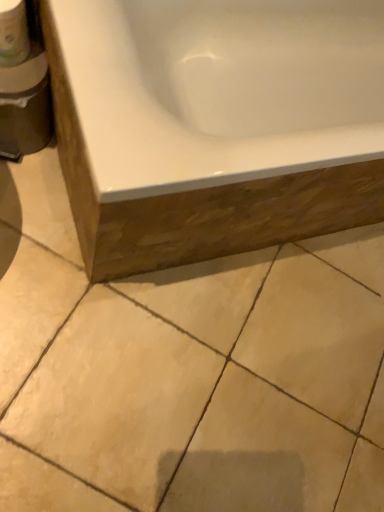
Question: Can you see beige ceramic tile at lower center touching white glossy bathtub at upper center?

Choices:
 (A) no
 (B) yes

Answer: (A)

Question: Can you confirm if beige ceramic tile at lower center is taller than white glossy bathtub at upper center?

Choices:
 (A) yes
 (B) no

Answer: (B)

Question: Is beige ceramic tile at lower center oriented towards white glossy bathtub at upper center?

Choices:
 (A) yes
 (B) no

Answer: (B)

Question: Does beige ceramic tile at lower center lie behind white glossy bathtub at upper center?

Choices:
 (A) no
 (B) yes

Answer: (B)

Question: Is beige ceramic tile at lower center completely or partially outside of white glossy bathtub at upper center?

Choices:
 (A) yes
 (B) no

Answer: (A)

Question: Considering the positions of white matte toilet paper at upper left and white glossy bathtub at upper center in the image, is white matte toilet paper at upper left taller or shorter than white glossy bathtub at upper center?

Choices:
 (A) short
 (B) tall

Answer: (A)

Question: Relative to white glossy bathtub at upper center, is white matte toilet paper at upper left in front or behind?

Choices:
 (A) behind
 (B) front

Answer: (A)

Question: Is point (9, 37) positioned closer to the camera than point (205, 145)?

Choices:
 (A) closer
 (B) farther

Answer: (B)

Question: Is white matte toilet paper at upper left wider or thinner than white glossy bathtub at upper center?

Choices:
 (A) wide
 (B) thin

Answer: (B)

Question: Considering the positions of beige ceramic tile at lower center and white matte toilet paper at upper left in the image, is beige ceramic tile at lower center bigger or smaller than white matte toilet paper at upper left?

Choices:
 (A) small
 (B) big

Answer: (B)

Question: From the image's perspective, relative to white matte toilet paper at upper left, is beige ceramic tile at lower center above or below?

Choices:
 (A) above
 (B) below

Answer: (B)

Question: Considering the positions of point 157,418 and point 11,10, is point 157,418 closer or farther from the camera than point 11,10?

Choices:
 (A) closer
 (B) farther

Answer: (B)

Question: Would you say beige ceramic tile at lower center is inside or outside white matte toilet paper at upper left?

Choices:
 (A) inside
 (B) outside

Answer: (B)

Question: In terms of width, does white matte toilet paper at upper left look wider or thinner when compared to beige ceramic tile at lower center?

Choices:
 (A) thin
 (B) wide

Answer: (A)

Question: Considering the relative positions of white matte toilet paper at upper left and beige ceramic tile at lower center in the image provided, is white matte toilet paper at upper left to the left or to the right of beige ceramic tile at lower center?

Choices:
 (A) left
 (B) right

Answer: (A)